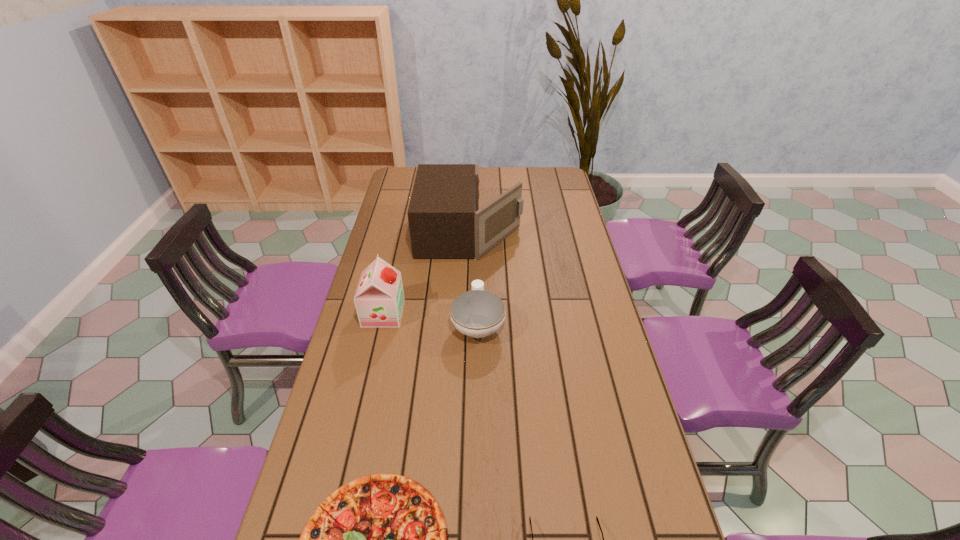
You are a GUI agent. You are given a task and a screenshot of the screen. Output one action in this format:
    pyautogui.click(x=<x>, y=<y>)
    Task: Click on the free space that satisfies the following two spatial constraints: 1. with the door open on the front of the microwave oven; 2. on the side with the handle of the third tallest object
    The image size is (960, 540).
    Given the screenshot: What is the action you would take?
    pyautogui.click(x=468, y=323)

Where is `blank area in the image that satisfies the following two spatial constraints: 1. with the cap open on the soya milk; 2. on the side with the handle of the third shortest object`? This screenshot has height=540, width=960. blank area in the image that satisfies the following two spatial constraints: 1. with the cap open on the soya milk; 2. on the side with the handle of the third shortest object is located at coordinates (381, 323).